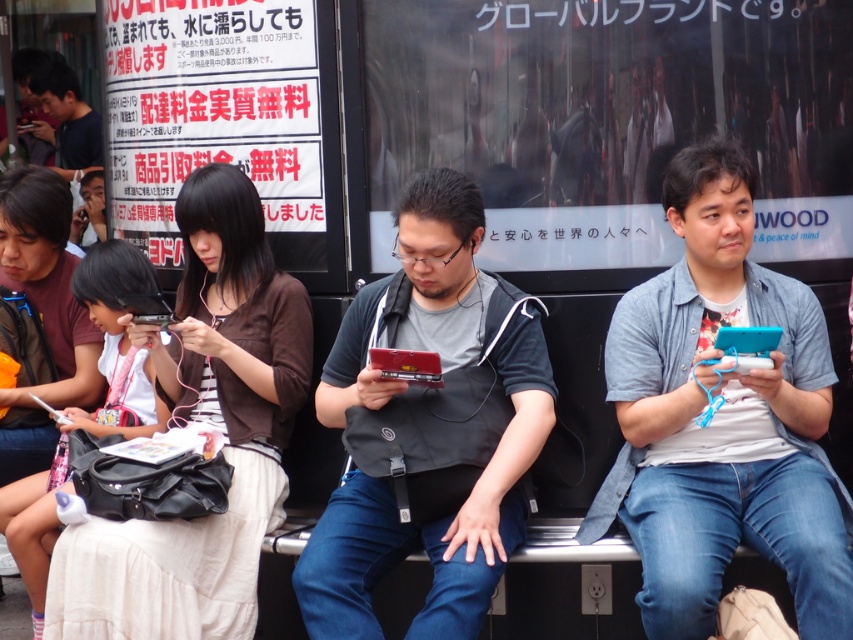
Measure the distance between blue matte phone at right and camera.

blue matte phone at right is 12.48 feet away from camera.

Is blue matte phone at right shorter than matte black handheld gaming console at center?

No.

Between point (639, 468) and point (469, 284), which one is positioned behind?

The point (469, 284) is more distant.

Image resolution: width=853 pixels, height=640 pixels. In order to click on blue matte phone at right in this screenshot , I will do `click(722, 419)`.